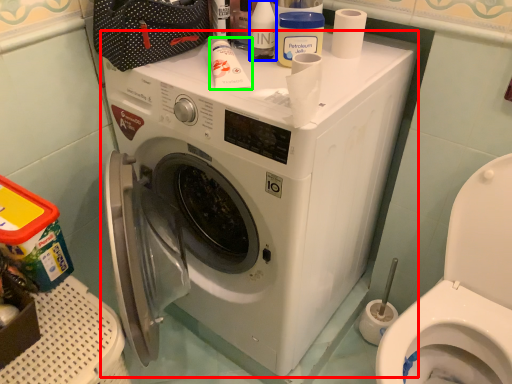
Question: Estimate the real-world distances between objects in this image. Which object is farther from washing machine (highlighted by a red box), toiletry (highlighted by a blue box) or toiletry (highlighted by a green box)?

Choices:
 (A) toiletry
 (B) toiletry

Answer: (A)